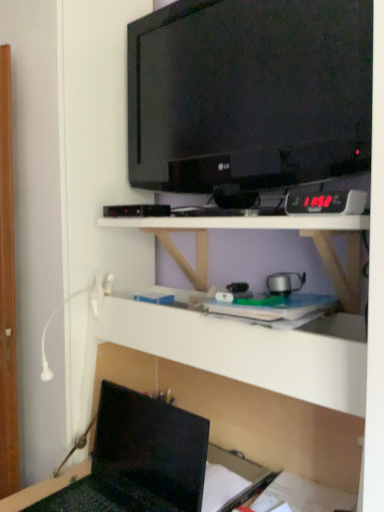
Question: Considering the positions of point pyautogui.click(x=109, y=497) and point pyautogui.click(x=183, y=112), is point pyautogui.click(x=109, y=497) closer or farther from the camera than point pyautogui.click(x=183, y=112)?

Choices:
 (A) closer
 (B) farther

Answer: (A)

Question: From the image's perspective, is matte black laptop at lower left positioned above or below black glossy tv at upper center?

Choices:
 (A) above
 (B) below

Answer: (B)

Question: Based on their relative distances, which object is farther from the white matte shelf at center, the first shelf positioned from the bottom?

Choices:
 (A) black glossy tv at upper center
 (B) matte black laptop at lower left
 (C) white matte shelf at center, the second shelf positioned from the bottom

Answer: (A)

Question: Which object is the farthest from the black glossy tv at upper center?

Choices:
 (A) matte black laptop at lower left
 (B) white matte shelf at center, the first shelf positioned from the bottom
 (C) white matte shelf at center, the second shelf positioned from the bottom

Answer: (A)